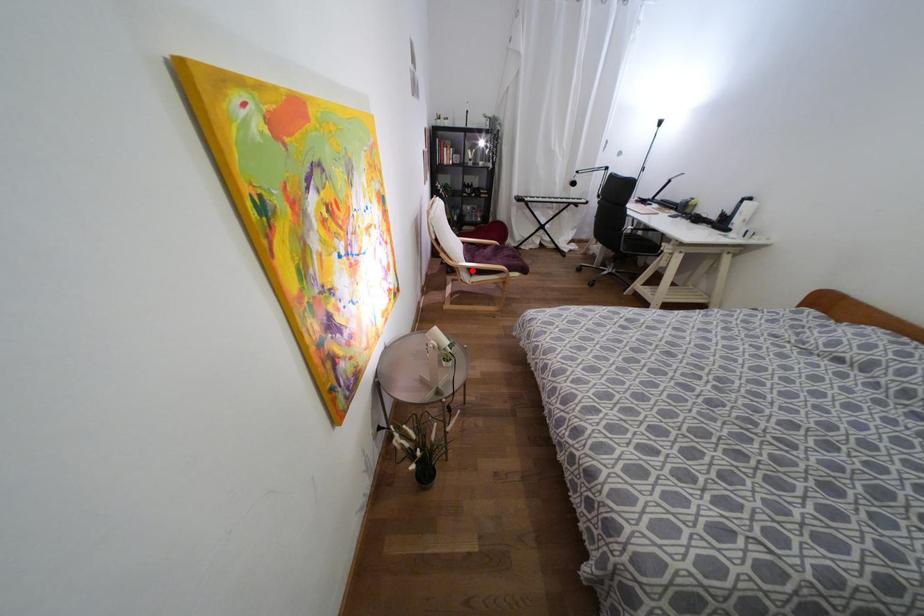
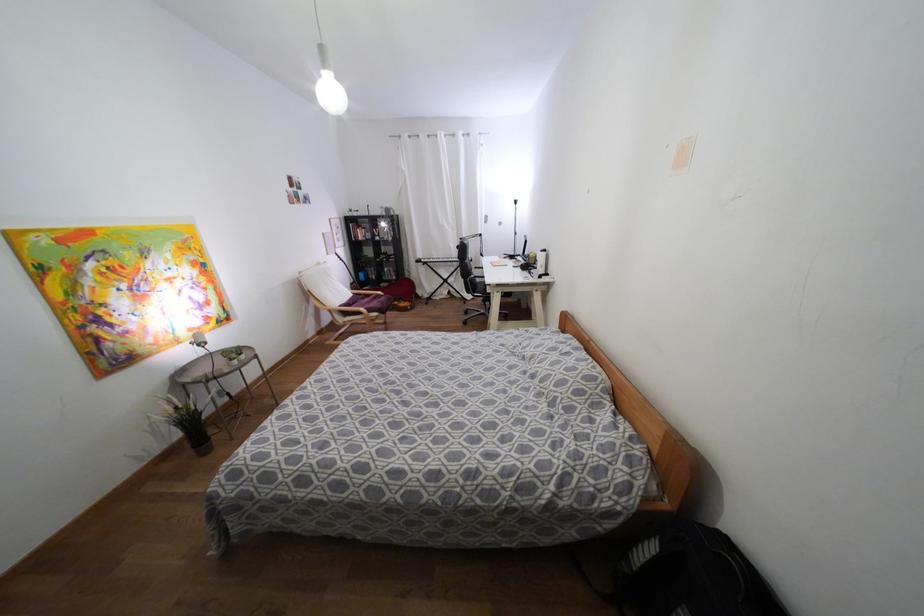
The point at the highlighted location is marked in the first image. Where is the corresponding point in the second image?

(344, 313)